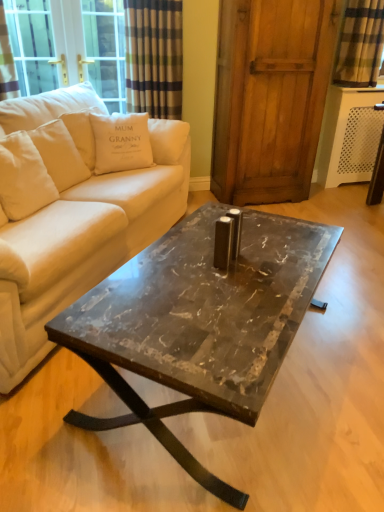
Question: From the image's perspective, is white cotton pillow at upper left, which appears as the first pillow when viewed from the left, below white cotton cushion at upper left, arranged as the second pillow when viewed from the left?

Choices:
 (A) no
 (B) yes

Answer: (A)

Question: From the image's perspective, is white cotton pillow at upper left, which appears as the first pillow when viewed from the left, on white cotton cushion at upper left, arranged as the second pillow when viewed from the left?

Choices:
 (A) no
 (B) yes

Answer: (B)

Question: Can you confirm if white cotton pillow at upper left, which appears as the first pillow when viewed from the left, is positioned to the left of white cotton cushion at upper left, arranged as the second pillow when viewed from the left?

Choices:
 (A) no
 (B) yes

Answer: (B)

Question: Considering the relative sizes of white cotton pillow at upper left, which ranks as the second pillow in right-to-left order, and white cotton cushion at upper left, which is the first pillow from right to left, in the image provided, is white cotton pillow at upper left, which ranks as the second pillow in right-to-left order, taller than white cotton cushion at upper left, which is the first pillow from right to left,?

Choices:
 (A) yes
 (B) no

Answer: (B)

Question: Does white cotton pillow at upper left, which ranks as the second pillow in right-to-left order, contain white cotton cushion at upper left, which is the first pillow from right to left?

Choices:
 (A) yes
 (B) no

Answer: (B)

Question: From the image's perspective, relative to plaid fabric curtain at upper right, is white cotton cushion at upper left, which is the first pillow from right to left, above or below?

Choices:
 (A) below
 (B) above

Answer: (A)

Question: Relative to plaid fabric curtain at upper right, is white cotton cushion at upper left, arranged as the second pillow when viewed from the left, in front or behind?

Choices:
 (A) behind
 (B) front

Answer: (B)

Question: Is white cotton cushion at upper left, arranged as the second pillow when viewed from the left, situated inside plaid fabric curtain at upper right or outside?

Choices:
 (A) inside
 (B) outside

Answer: (B)

Question: In terms of width, does white cotton cushion at upper left, arranged as the second pillow when viewed from the left, look wider or thinner when compared to plaid fabric curtain at upper right?

Choices:
 (A) thin
 (B) wide

Answer: (B)

Question: From the image's perspective, is white cotton pillow at upper left, which appears as the first pillow when viewed from the left, above or below beige fabric couch at center?

Choices:
 (A) below
 (B) above

Answer: (B)

Question: Based on their sizes in the image, would you say white cotton pillow at upper left, which appears as the first pillow when viewed from the left, is bigger or smaller than beige fabric couch at center?

Choices:
 (A) small
 (B) big

Answer: (A)

Question: Do you think white cotton pillow at upper left, which appears as the first pillow when viewed from the left, is within beige fabric couch at center, or outside of it?

Choices:
 (A) outside
 (B) inside

Answer: (B)

Question: From a real-world perspective, is white cotton pillow at upper left, which appears as the first pillow when viewed from the left, physically located above or below beige fabric couch at center?

Choices:
 (A) above
 (B) below

Answer: (A)

Question: From a real-world perspective, is marble/black at center above or below wooden screen door at center?

Choices:
 (A) below
 (B) above

Answer: (A)

Question: Considering the positions of point (221, 484) and point (299, 39), is point (221, 484) closer or farther from the camera than point (299, 39)?

Choices:
 (A) farther
 (B) closer

Answer: (B)